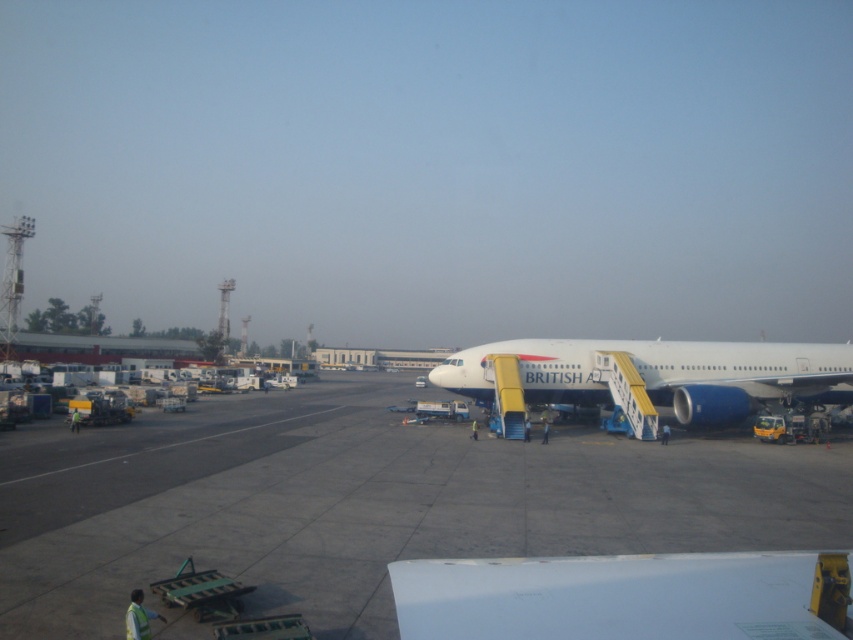
Is gray concrete tarmac at center further to the viewer compared to white matte airplane at center?

No, it is in front of white matte airplane at center.

From the picture: Does gray concrete tarmac at center lie in front of white matte airplane at center?

Yes, it is.

Does point (16, 524) lie behind point (491, 378)?

No, it is not.

Image resolution: width=853 pixels, height=640 pixels. Find the location of `gray concrete tarmac at center`. gray concrete tarmac at center is located at coordinates (366, 502).